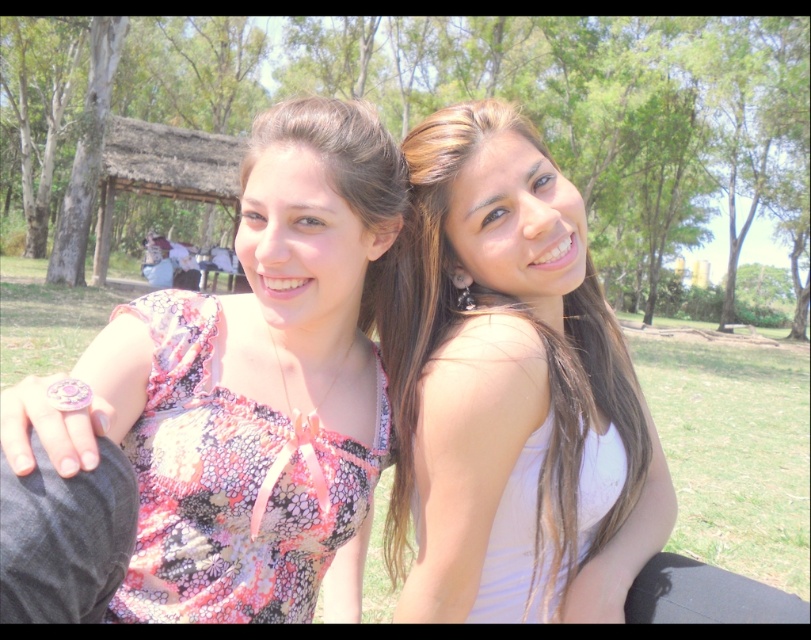
Does floral fabric dress at center have a smaller size compared to white matte tank top at right?

No, floral fabric dress at center is not smaller than white matte tank top at right.

Which is above, floral fabric dress at center or white matte tank top at right?

floral fabric dress at center is higher up.

The image size is (811, 640). Describe the element at coordinates (267, 385) in the screenshot. I see `floral fabric dress at center` at that location.

Where is `floral fabric dress at center`? floral fabric dress at center is located at coordinates (267, 385).

Find the location of a particular element. The height and width of the screenshot is (640, 811). white matte tank top at right is located at coordinates (515, 387).

Does white matte tank top at right have a lesser height compared to floral-patterned fabric dress at center?

Incorrect, white matte tank top at right's height does not fall short of floral-patterned fabric dress at center's.

At what (x,y) coordinates should I click in order to perform the action: click on white matte tank top at right. Please return your answer as a coordinate pair (x, y). Looking at the image, I should click on (515, 387).

Locate an element on the screen. The width and height of the screenshot is (811, 640). white matte tank top at right is located at coordinates (515, 387).

Who is higher up, floral fabric dress at center or floral-patterned fabric dress at center?

floral fabric dress at center is above.

The image size is (811, 640). Describe the element at coordinates (267, 385) in the screenshot. I see `floral fabric dress at center` at that location.

Is point (198, 332) in front of point (185, 529)?

No, (198, 332) is further to viewer.

Locate an element on the screen. floral fabric dress at center is located at coordinates (267, 385).